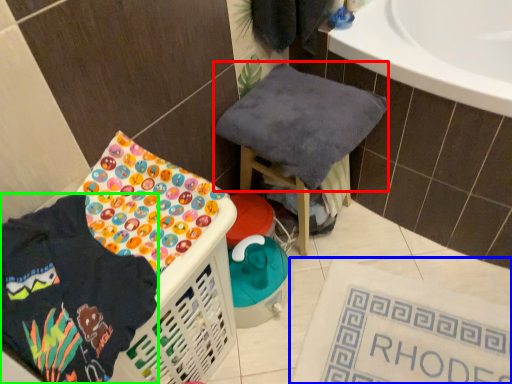
Question: Which object is positioned farthest from baby clothe (highlighted by a red box)? Select from bath mat (highlighted by a blue box) and clothing (highlighted by a green box).

Choices:
 (A) bath mat
 (B) clothing

Answer: (B)